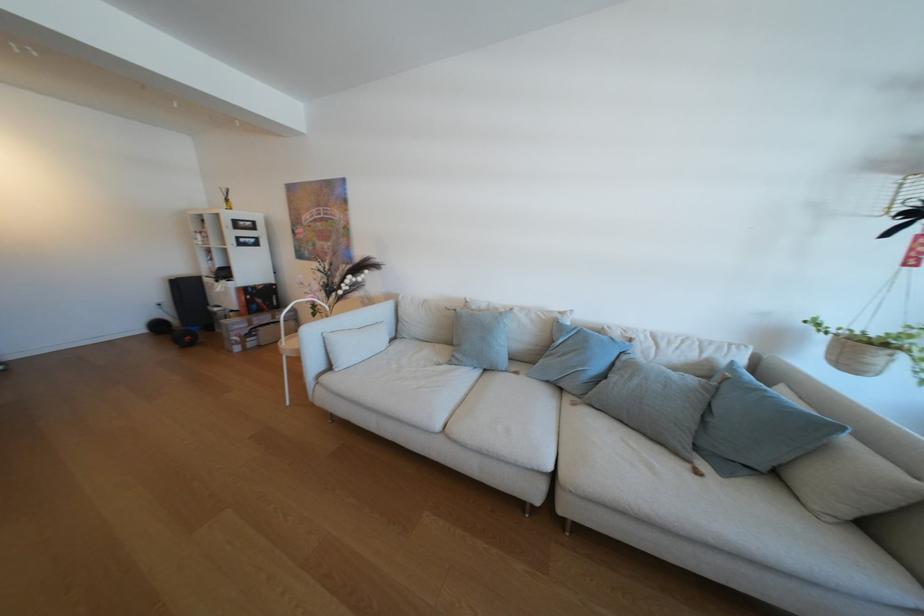
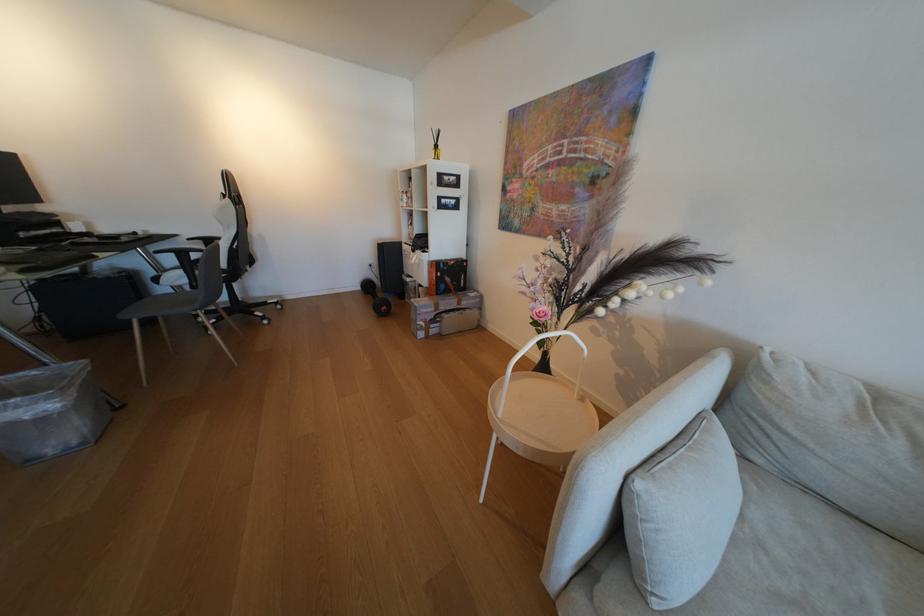
In the second image, find the point that corresponds to point 261,336 in the first image.

(444, 322)